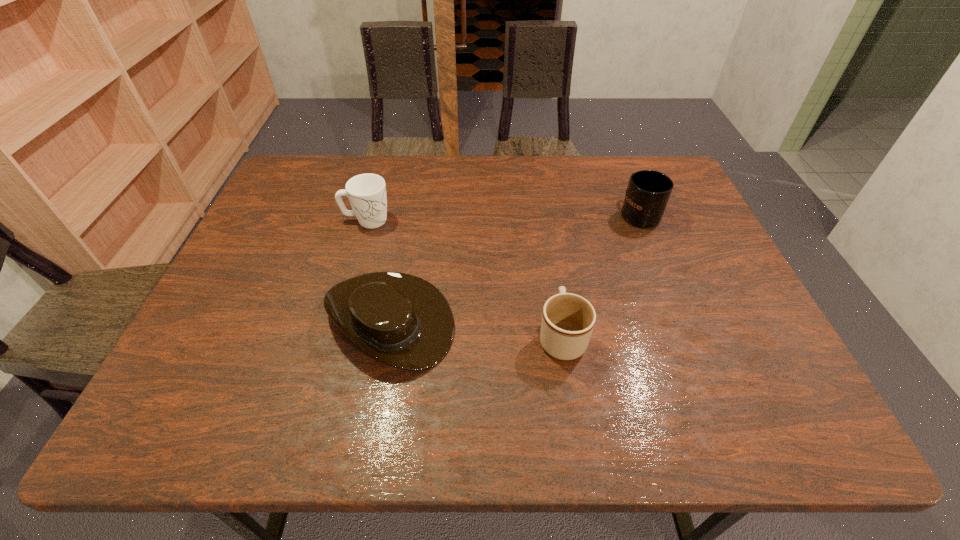
The height and width of the screenshot is (540, 960). What are the coordinates of `vacant area situated 0.140m on the side of the second mug from right to left with the handle` in the screenshot? It's located at (551, 268).

You are a GUI agent. You are given a task and a screenshot of the screen. Output one action in this format:
    pyautogui.click(x=<x>, y=<y>)
    Task: Click on the vacant space situated 0.280m on the side of the second mug from right to left with the handle
    The height and width of the screenshot is (540, 960).
    Given the screenshot: What is the action you would take?
    pyautogui.click(x=545, y=231)

Identify the location of vacant space located on the left of the shortest object. The width and height of the screenshot is (960, 540). (205, 320).

The image size is (960, 540). Find the location of `object that is at the far edge`. object that is at the far edge is located at coordinates (648, 192).

The width and height of the screenshot is (960, 540). Identify the location of object located in the right edge section of the desktop. (648, 192).

Image resolution: width=960 pixels, height=540 pixels. Find the location of `object that is at the far right corner`. object that is at the far right corner is located at coordinates (648, 192).

The image size is (960, 540). I want to click on free region at the far edge of the desktop, so click(x=505, y=172).

Where is `vacant area at the near edge of the desktop`? The height and width of the screenshot is (540, 960). vacant area at the near edge of the desktop is located at coordinates (467, 427).

Find the location of a particular element. vacant space at the left edge of the desktop is located at coordinates tap(227, 333).

Identify the location of free region at the right edge of the desktop. (714, 316).